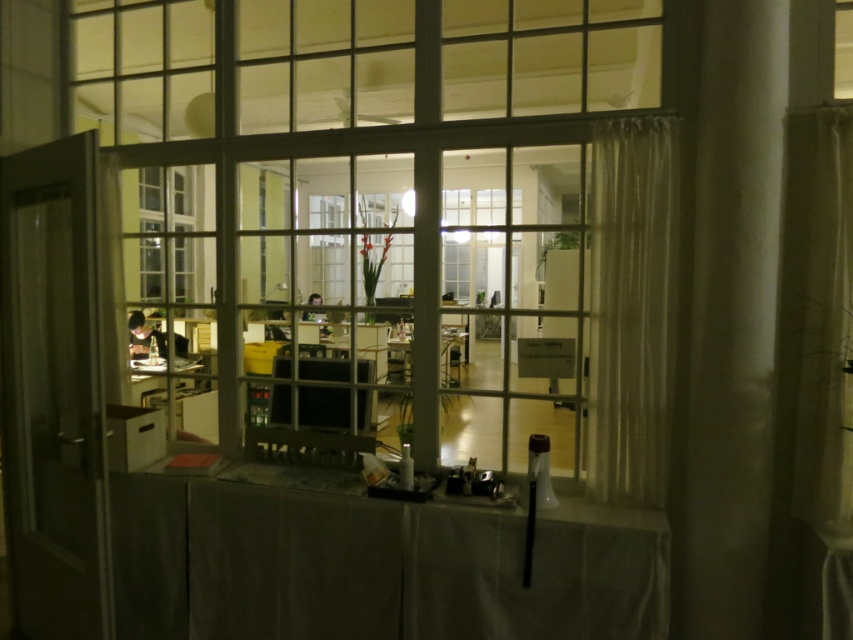
You are a delivery person standing outside the office at night. You need to enter through the transparent glass door at left but first want to check if there is enough space between it and the sheer white curtain at right to carry a large box that is 1.8 meters wide. Can you fit the box through the space between them?

The transparent glass door at left and sheer white curtain at right are 1.74 meters apart. Since the box is 1.8 meters wide, it is slightly wider than the available space, so the box cannot fit through the space between them.

You are standing in front of the window shown in the scene. Where is the smooth gray table at center located in relation to the window?

The smooth gray table at center is located at point (374,564) in the scene.